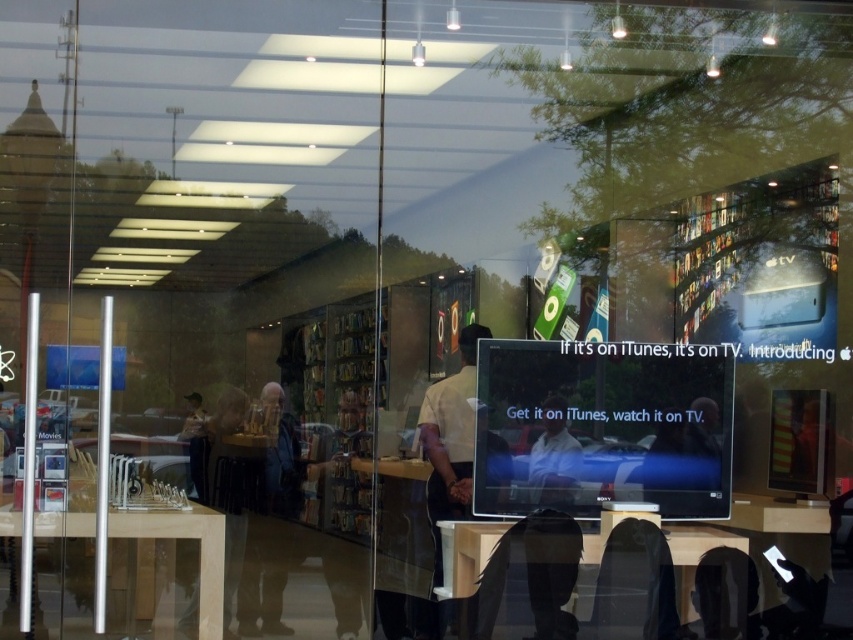
Measure the distance between point [450,531] and camera.

Point [450,531] is 4.84 meters from camera.

Is matte black table at lower center taller than light brown wooden table at left?

No.

Is point (460, 540) less distant than point (86, 531)?

Yes, it is.

You are a GUI agent. You are given a task and a screenshot of the screen. Output one action in this format:
    pyautogui.click(x=<x>, y=<y>)
    Task: Click on the matte black table at lower center
    Image resolution: width=853 pixels, height=640 pixels.
    Given the screenshot: What is the action you would take?
    pyautogui.click(x=466, y=552)